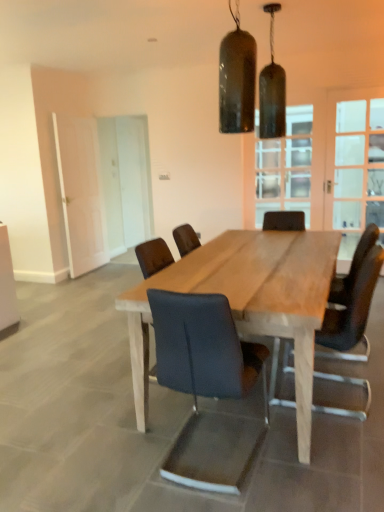
Identify the location of white matte door at left, which is the first screen door from left to right. The image size is (384, 512). (81, 192).

The width and height of the screenshot is (384, 512). Describe the element at coordinates (237, 79) in the screenshot. I see `matte glass pendant lights at upper center, acting as the 1th lamp starting from the front` at that location.

How much space does clear glass door at center, marked as the 1th glass door in a left-to-right arrangement, occupy vertically?

The height of clear glass door at center, marked as the 1th glass door in a left-to-right arrangement, is 2.09 meters.

The height and width of the screenshot is (512, 384). I want to click on clear glass window at upper center, so click(x=285, y=167).

Which of these two, natural wood table at center or matte black chair at center, the second chair viewed from the right, is bigger?

With larger size is natural wood table at center.

Is natural wood table at center closer to the viewer compared to matte black chair at center, the second chair viewed from the right?

No.

How many degrees apart are the facing directions of natural wood table at center and matte black chair at center, placed as the 2th chair when sorted from left to right?

The angle between the facing direction of natural wood table at center and the facing direction of matte black chair at center, placed as the 2th chair when sorted from left to right, is 0.469 degrees.

From the picture: From the image's perspective, which object appears higher, natural wood table at center or matte black chair at center, placed as the 2th chair when sorted from left to right?

natural wood table at center, from the image's perspective.

Considering the relative sizes of dark blue fabric chair at center, the 3th chair positioned from the right, and matte black pendant light at upper center, which ranks as the first lamp in back-to-front order, in the image provided, is dark blue fabric chair at center, the 3th chair positioned from the right, thinner than matte black pendant light at upper center, which ranks as the first lamp in back-to-front order,?

In fact, dark blue fabric chair at center, the 3th chair positioned from the right, might be wider than matte black pendant light at upper center, which ranks as the first lamp in back-to-front order.

From the image's perspective, is dark blue fabric chair at center, the 3th chair positioned from the right, below matte black pendant light at upper center, the second lamp viewed from the left?

Yes.

Considering the sizes of objects dark blue fabric chair at center, which appears as the 1th chair when viewed from the left, and matte black pendant light at upper center, which is the second lamp in front-to-back order, in the image provided, who is shorter, dark blue fabric chair at center, which appears as the 1th chair when viewed from the left, or matte black pendant light at upper center, which is the second lamp in front-to-back order,?

dark blue fabric chair at center, which appears as the 1th chair when viewed from the left.

Considering the relative sizes of dark blue fabric chair at center, which appears as the 1th chair when viewed from the left, and matte black pendant light at upper center, acting as the 1th lamp starting from the right, in the image provided, is dark blue fabric chair at center, which appears as the 1th chair when viewed from the left, bigger than matte black pendant light at upper center, acting as the 1th lamp starting from the right,?

Indeed, dark blue fabric chair at center, which appears as the 1th chair when viewed from the left, has a larger size compared to matte black pendant light at upper center, acting as the 1th lamp starting from the right.

How many degrees apart are the facing directions of dark blue fabric chair at center, the 3th chair positioned from the right, and clear glass door at center, marked as the 1th glass door in a left-to-right arrangement?

The angular difference between dark blue fabric chair at center, the 3th chair positioned from the right, and clear glass door at center, marked as the 1th glass door in a left-to-right arrangement, is 91 degrees.

Based on the photo, between dark blue fabric chair at center, the 3th chair positioned from the right, and clear glass door at center, acting as the 2th glass door starting from the right, which one has smaller size?

With smaller size is dark blue fabric chair at center, the 3th chair positioned from the right.

Is dark blue fabric chair at center, which appears as the 1th chair when viewed from the left, oriented towards clear glass door at center, marked as the 1th glass door in a left-to-right arrangement?

No, dark blue fabric chair at center, which appears as the 1th chair when viewed from the left, does not turn towards clear glass door at center, marked as the 1th glass door in a left-to-right arrangement.

From a real-world perspective, is dark blue fabric chair at center, the 3th chair positioned from the right, above or below clear glass door at center, acting as the 2th glass door starting from the right?

dark blue fabric chair at center, the 3th chair positioned from the right, is situated lower than clear glass door at center, acting as the 2th glass door starting from the right, in the real world.

Is dark blue fabric chair at center, the 3th chair positioned from the right, spatially inside clear glass window at upper center, or outside of it?

dark blue fabric chair at center, the 3th chair positioned from the right, is spatially situated outside clear glass window at upper center.

Is dark blue fabric chair at center, the 3th chair positioned from the right, bigger than clear glass window at upper center?

Correct, dark blue fabric chair at center, the 3th chair positioned from the right, is larger in size than clear glass window at upper center.

From a real-world perspective, is dark blue fabric chair at center, which appears as the 1th chair when viewed from the left, above or below clear glass window at upper center?

Clearly, from a real-world perspective, dark blue fabric chair at center, which appears as the 1th chair when viewed from the left, is below clear glass window at upper center.

Does point (256, 367) come closer to viewer compared to point (260, 212)?

Yes, point (256, 367) is in front of point (260, 212).

The height and width of the screenshot is (512, 384). I want to click on chair that is the 3rd object located below the clear glass door at center, acting as the 2th glass door starting from the right (from the image's perspective), so click(208, 388).

Which is more to the right, matte black chair at center, the second chair viewed from the right, or clear glass door at center, marked as the 1th glass door in a left-to-right arrangement?

clear glass door at center, marked as the 1th glass door in a left-to-right arrangement, is more to the right.

Considering the relative sizes of matte black chair at center, placed as the 2th chair when sorted from left to right, and clear glass door at center, acting as the 2th glass door starting from the right, in the image provided, is matte black chair at center, placed as the 2th chair when sorted from left to right, thinner than clear glass door at center, acting as the 2th glass door starting from the right,?

No.

Which of these two, clear glass window at upper center or clear glass door at right, the 1th glass door viewed from the right, is wider?

With larger width is clear glass window at upper center.

From a real-world perspective, is clear glass window at upper center under clear glass door at right, the 1th glass door viewed from the right?

No, from a real-world perspective, clear glass window at upper center is not under clear glass door at right, the 1th glass door viewed from the right.

Does point (258, 167) come behind point (353, 134)?

Yes, point (258, 167) is behind point (353, 134).

In the scene shown: Is clear glass window at upper center bigger or smaller than clear glass door at right, which is the second glass door in left-to-right order?

clear glass window at upper center is bigger than clear glass door at right, which is the second glass door in left-to-right order.

Is matte black pendant light at upper center, acting as the 1th lamp starting from the right, situated inside dark blue fabric chair at center, which appears as the 1th chair when viewed from the left, or outside?

matte black pendant light at upper center, acting as the 1th lamp starting from the right, is outside dark blue fabric chair at center, which appears as the 1th chair when viewed from the left.

Is matte black pendant light at upper center, the second lamp viewed from the left, touching dark blue fabric chair at center, the 3th chair positioned from the right?

matte black pendant light at upper center, the second lamp viewed from the left, is not next to dark blue fabric chair at center, the 3th chair positioned from the right, and they're not touching.

Who is more distant, matte black pendant light at upper center, which is the second lamp in front-to-back order, or dark blue fabric chair at center, the 3th chair positioned from the right?

Positioned behind is matte black pendant light at upper center, which is the second lamp in front-to-back order.

Which of these two, matte black pendant light at upper center, the second lamp viewed from the left, or dark blue fabric chair at center, the 3th chair positioned from the right, is smaller?

With smaller size is matte black pendant light at upper center, the second lamp viewed from the left.

This screenshot has height=512, width=384. What are the coordinates of `kitchen & dining room table lying behind the matte black chair at center, the second chair viewed from the right` in the screenshot? It's located at (248, 301).

Where is `the 2nd lamp to the right of the dark blue fabric chair at center, which appears as the 1th chair when viewed from the left, starting your count from the anchor`? This screenshot has width=384, height=512. the 2nd lamp to the right of the dark blue fabric chair at center, which appears as the 1th chair when viewed from the left, starting your count from the anchor is located at coordinates (272, 90).

Based on the photo, considering their positions, is clear glass door at center, acting as the 2th glass door starting from the right, positioned further to white matte door at left, which is the first screen door from left to right, than white glass screen door at left, marked as the 2th screen door in a left-to-right arrangement?

Among the two, clear glass door at center, acting as the 2th glass door starting from the right, is located further to white matte door at left, which is the first screen door from left to right.

When comparing their distances from matte glass pendant lights at upper center, the 2th lamp viewed from the right, does dark blue fabric chair at center, which appears as the 1th chair when viewed from the left, or leather-like black chair at center, which is counted as the 3th chair, starting from the left, seem closer?

dark blue fabric chair at center, which appears as the 1th chair when viewed from the left, is closer to matte glass pendant lights at upper center, the 2th lamp viewed from the right.

Estimate the real-world distances between objects in this image. Which object is further from white matte door at left, the 2th screen door from the right, clear glass door at center, acting as the 2th glass door starting from the right, or matte glass pendant lights at upper center, the 2th lamp viewed from the right?

matte glass pendant lights at upper center, the 2th lamp viewed from the right, is positioned further to the anchor white matte door at left, the 2th screen door from the right.

Based on their spatial positions, is matte black chair at center, the second chair viewed from the right, or white glass screen door at left, marked as the 2th screen door in a left-to-right arrangement, closer to matte glass pendant lights at upper center, which is counted as the first lamp, starting from the left?

Based on the image, matte black chair at center, the second chair viewed from the right, appears to be nearer to matte glass pendant lights at upper center, which is counted as the first lamp, starting from the left.

Estimate the real-world distances between objects in this image. Which object is closer to dark blue fabric chair at center, the 3th chair positioned from the right, matte glass pendant lights at upper center, the 2th lamp viewed from the right, or natural wood table at center?

Answer: natural wood table at center.

Based on their spatial positions, is white glass screen door at left, marked as the 1th screen door in a right-to-left arrangement, or clear glass window at upper center closer to matte glass pendant lights at upper center, which is counted as the first lamp, starting from the left?

clear glass window at upper center.

Looking at the image, which one is located closer to dark blue fabric chair at center, which appears as the 1th chair when viewed from the left, white glass screen door at left, marked as the 1th screen door in a right-to-left arrangement, or clear glass window at upper center?

clear glass window at upper center is positioned closer to the anchor dark blue fabric chair at center, which appears as the 1th chair when viewed from the left.

Consider the image. Looking at the image, which one is located further to matte black chair at center, placed as the 2th chair when sorted from left to right, clear glass window at upper center or matte glass pendant lights at upper center, the 2th lamp viewed from the right?

The object further to matte black chair at center, placed as the 2th chair when sorted from left to right, is clear glass window at upper center.

Locate an element on the screen. The width and height of the screenshot is (384, 512). glass door between matte black chair at center, placed as the 2th chair when sorted from left to right, and clear glass door at right, the 1th glass door viewed from the right, in the front-back direction is located at coordinates (325, 161).

Identify the location of lamp between leather-like black chair at center, the first chair in the right-to-left sequence, and clear glass door at center, marked as the 1th glass door in a left-to-right arrangement, from front to back. This screenshot has width=384, height=512. (272, 90).

Find the location of `lamp between matte black pendant light at upper center, acting as the 1th lamp starting from the right, and dark blue fabric chair at center, the 3th chair positioned from the right, vertically`. lamp between matte black pendant light at upper center, acting as the 1th lamp starting from the right, and dark blue fabric chair at center, the 3th chair positioned from the right, vertically is located at coordinates (237, 79).

The width and height of the screenshot is (384, 512). Find the location of `lamp located between matte glass pendant lights at upper center, which is counted as the first lamp, starting from the left, and clear glass door at right, which is the second glass door in left-to-right order, in the depth direction`. lamp located between matte glass pendant lights at upper center, which is counted as the first lamp, starting from the left, and clear glass door at right, which is the second glass door in left-to-right order, in the depth direction is located at coordinates (272, 90).